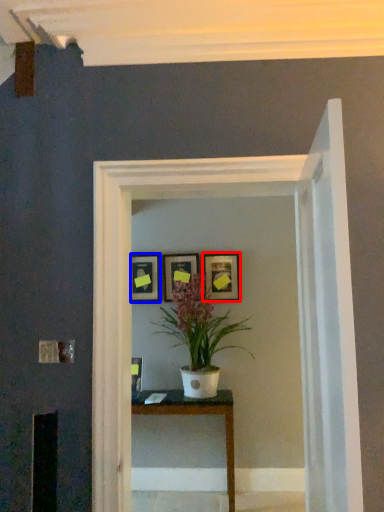
Question: Which object appears closest to the camera in this image, picture frame (highlighted by a red box) or picture frame (highlighted by a blue box)?

Choices:
 (A) picture frame
 (B) picture frame

Answer: (A)